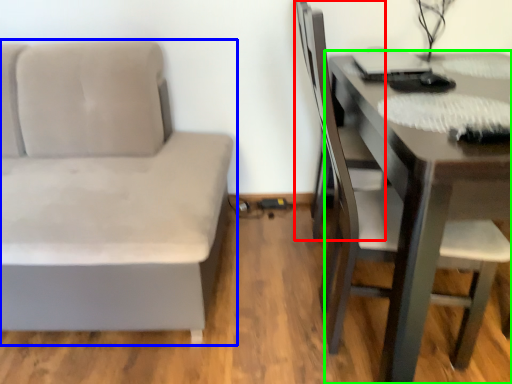
Question: Which object is positioned farthest from swivel chair (highlighted by a red box)? Select from studio couch (highlighted by a blue box) and table (highlighted by a green box).

Choices:
 (A) studio couch
 (B) table

Answer: (A)